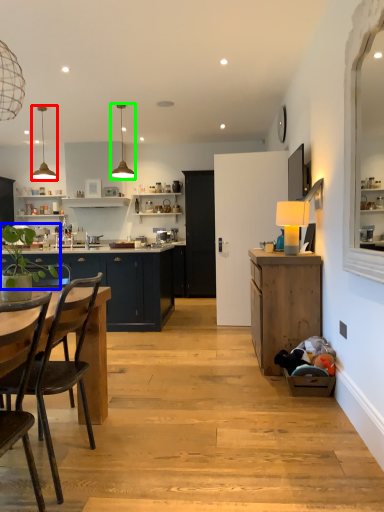
Question: Which object is the closest to the lamp (highlighted by a red box)? Choose among these: plant (highlighted by a blue box) or lamp (highlighted by a green box).

Choices:
 (A) plant
 (B) lamp

Answer: (B)